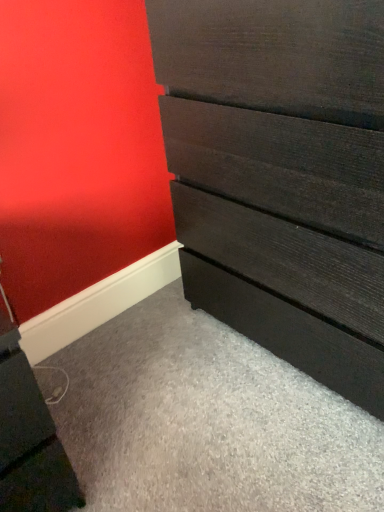
Question: Is the depth of matte black file cabinet at lower left greater than that of dark wood chest of drawers at center?

Choices:
 (A) yes
 (B) no

Answer: (A)

Question: Considering the relative sizes of matte black file cabinet at lower left and dark wood chest of drawers at center in the image provided, is matte black file cabinet at lower left taller than dark wood chest of drawers at center?

Choices:
 (A) no
 (B) yes

Answer: (A)

Question: Are matte black file cabinet at lower left and dark wood chest of drawers at center located far from each other?

Choices:
 (A) no
 (B) yes

Answer: (A)

Question: From a real-world perspective, is matte black file cabinet at lower left positioned under dark wood chest of drawers at center based on gravity?

Choices:
 (A) yes
 (B) no

Answer: (A)

Question: From a real-world perspective, is matte black file cabinet at lower left over dark wood chest of drawers at center?

Choices:
 (A) no
 (B) yes

Answer: (A)

Question: Does matte black file cabinet at lower left appear on the right side of dark wood chest of drawers at center?

Choices:
 (A) no
 (B) yes

Answer: (A)

Question: From the image's perspective, is dark wood chest of drawers at center on top of matte black file cabinet at lower left?

Choices:
 (A) no
 (B) yes

Answer: (B)

Question: Considering the relative sizes of dark wood chest of drawers at center and matte black file cabinet at lower left in the image provided, is dark wood chest of drawers at center bigger than matte black file cabinet at lower left?

Choices:
 (A) no
 (B) yes

Answer: (B)

Question: Does dark wood chest of drawers at center have a smaller size compared to matte black file cabinet at lower left?

Choices:
 (A) yes
 (B) no

Answer: (B)

Question: Considering the relative sizes of dark wood chest of drawers at center and matte black file cabinet at lower left in the image provided, is dark wood chest of drawers at center wider than matte black file cabinet at lower left?

Choices:
 (A) no
 (B) yes

Answer: (B)

Question: Considering the relative sizes of dark wood chest of drawers at center and matte black file cabinet at lower left in the image provided, is dark wood chest of drawers at center shorter than matte black file cabinet at lower left?

Choices:
 (A) no
 (B) yes

Answer: (A)

Question: From the image's perspective, is dark wood chest of drawers at center below matte black file cabinet at lower left?

Choices:
 (A) yes
 (B) no

Answer: (B)

Question: Considering the positions of dark wood chest of drawers at center and matte black file cabinet at lower left in the image, is dark wood chest of drawers at center taller or shorter than matte black file cabinet at lower left?

Choices:
 (A) tall
 (B) short

Answer: (A)